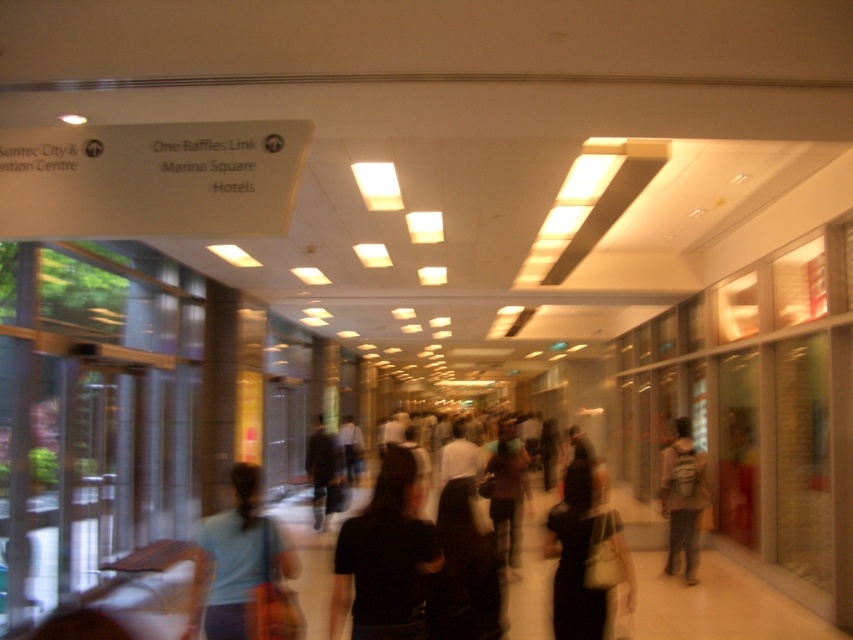
You are a security guard in the mall and notice a person wearing a black matte shirt at center and carrying a light brown backpack at center. From your vantage point, which item is nearer to you?

The black matte shirt at center is closer to the viewer than the light brown backpack at center.

You are standing in the corridor and want to take a photo of the black matte shirt at center. Where should you position yourself to capture the shirt in the center of your camera viewfinder?

Position yourself directly in front of the black matte shirt at center to center it in your camera viewfinder.